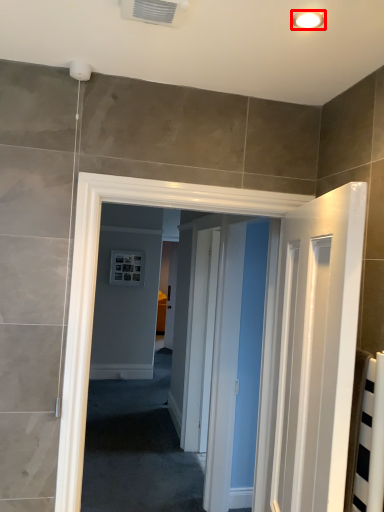
Question: Considering the relative positions of light fixture (annotated by the red box) and air conditioning in the image provided, where is light fixture (annotated by the red box) located with respect to the staircase?

Choices:
 (A) right
 (B) left

Answer: (A)